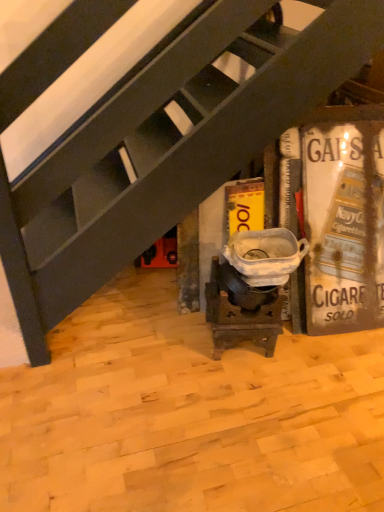
Question: Should I look upward or downward to see metallic vintage sign at right?

Choices:
 (A) down
 (B) up

Answer: (B)